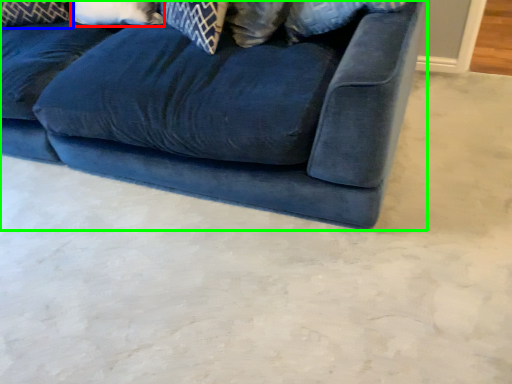
Question: Estimate the real-world distances between objects in this image. Which object is farther from pillow (highlighted by a red box), pillow (highlighted by a blue box) or studio couch (highlighted by a green box)?

Choices:
 (A) pillow
 (B) studio couch

Answer: (B)